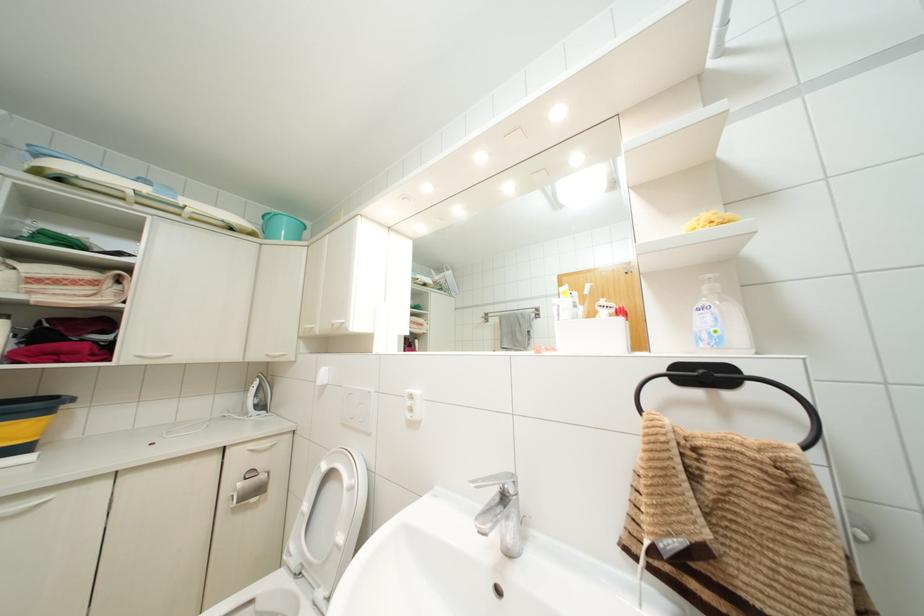
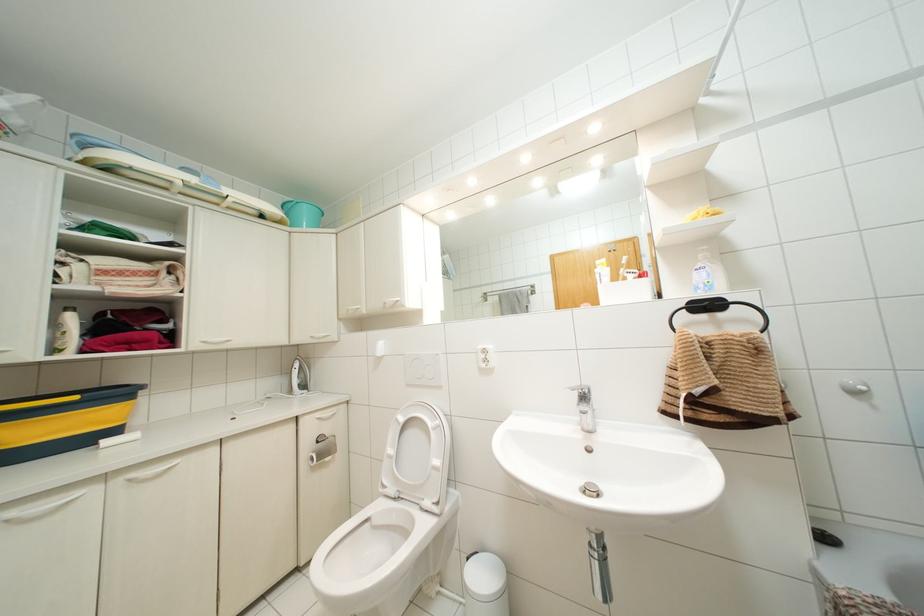
The point at (706, 215) is marked in the first image. Where is the corresponding point in the second image?

(701, 208)